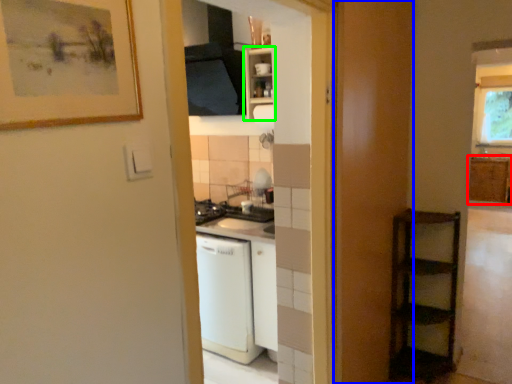
Question: Estimate the real-world distances between objects in this image. Which object is closer to cabinetry (highlighted by a red box), screen door (highlighted by a blue box) or cabinetry (highlighted by a green box)?

Choices:
 (A) screen door
 (B) cabinetry

Answer: (A)